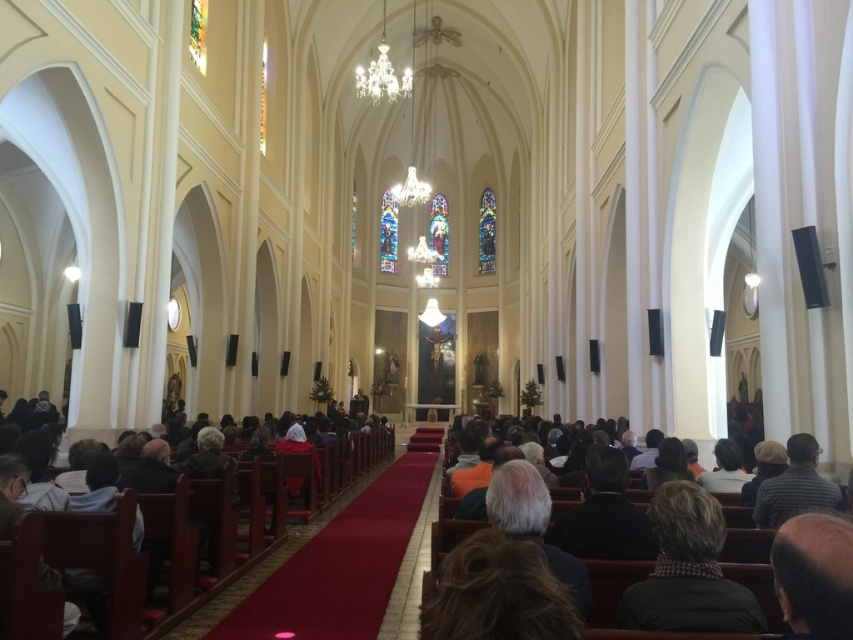
Question: Is dark brown leather jacket at lower right further to the viewer compared to dark brown leather jacket at center?

Choices:
 (A) yes
 (B) no

Answer: (B)

Question: Which object is closer to the camera taking this photo?

Choices:
 (A) dark brown leather jacket at lower right
 (B) dark brown wooden pew at center
 (C) dark brown leather jacket at center

Answer: (A)

Question: Which point is closer to the camera taking this photo?

Choices:
 (A) tap(210, 589)
 (B) tap(726, 570)
 (C) tap(724, 600)

Answer: (C)

Question: Is dark brown leather jacket at lower right to the left of dark brown leather jacket at center from the viewer's perspective?

Choices:
 (A) yes
 (B) no

Answer: (B)

Question: Among these objects, which one is nearest to the camera?

Choices:
 (A) dark brown wooden pew at center
 (B) dark brown leather jacket at lower right

Answer: (B)

Question: Is dark brown leather jacket at lower right above dark brown wooden pew at center?

Choices:
 (A) yes
 (B) no

Answer: (A)